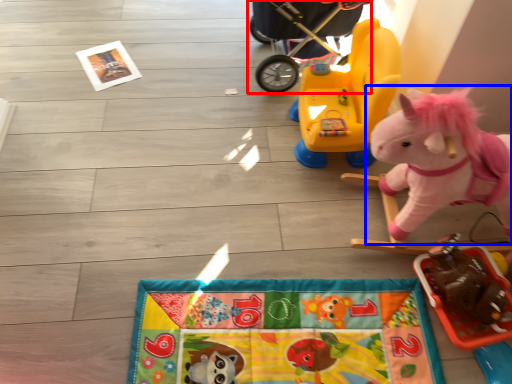
Question: Which object is further to the camera taking this photo, baby carriage (highlighted by a red box) or toy (highlighted by a blue box)?

Choices:
 (A) baby carriage
 (B) toy

Answer: (A)